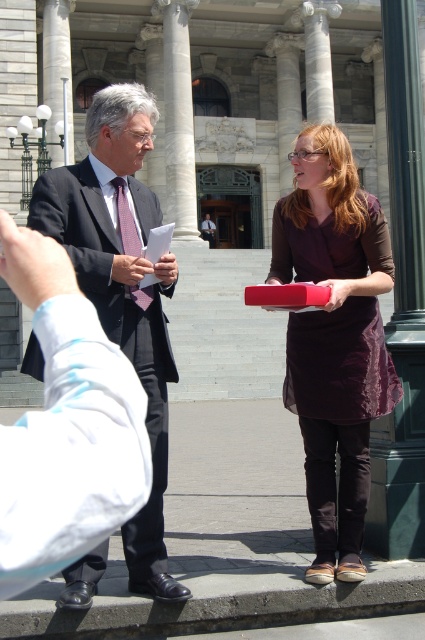
Does point (359, 209) come closer to viewer compared to point (159, 468)?

No, (359, 209) is behind (159, 468).

Who is taller, matte purple dress at center or matte black suit at left?

matte purple dress at center is taller.

Locate an element on the screen. This screenshot has width=425, height=640. matte purple dress at center is located at coordinates (334, 339).